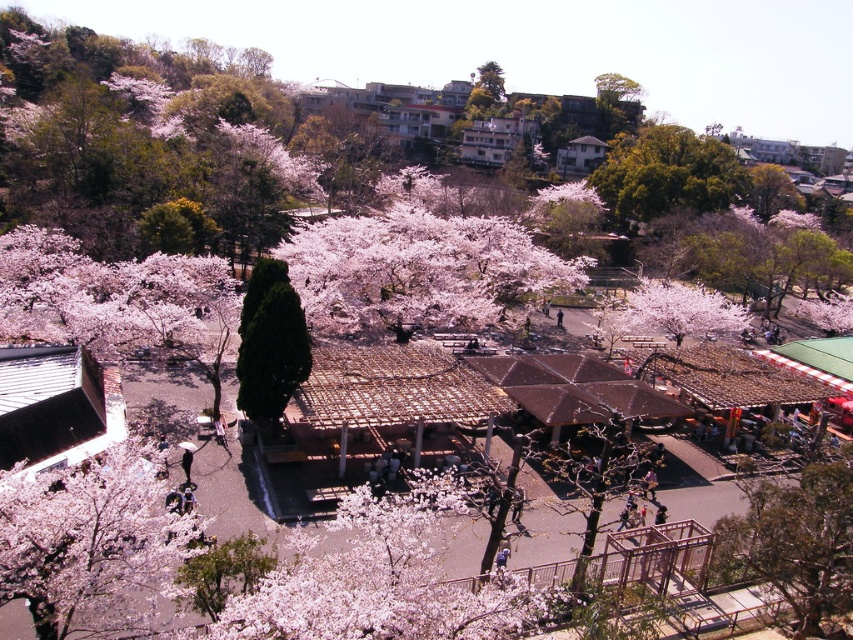
Who is shorter, pink matte flower at center or green textured tree at lower right?

With less height is green textured tree at lower right.

Measure the distance from pink matte flower at center to green textured tree at lower right.

pink matte flower at center is 43.36 meters away from green textured tree at lower right.

Between point (67, 298) and point (776, 486), which one is positioned in front?

Point (776, 486)

Find the location of `pink matte flower at center`. pink matte flower at center is located at coordinates (111, 298).

Which is more to the right, fluffy pink blossoms at lower left or green textured tree at lower right?

From the viewer's perspective, green textured tree at lower right appears more on the right side.

Is fluffy pink blossoms at lower left further to the viewer compared to green textured tree at lower right?

No.

Find the location of a particular element. Image resolution: width=853 pixels, height=640 pixels. fluffy pink blossoms at lower left is located at coordinates (91, 545).

Between green leafy tree at upper center and dark green textured tree at center, which one is positioned higher?

Positioned higher is green leafy tree at upper center.

Measure the distance between point (x=706, y=163) and camera.

A distance of 472.39 feet exists between point (x=706, y=163) and camera.

Is point (608, 172) positioned after point (270, 417)?

Yes, point (608, 172) is farther from viewer.

Identify the location of green leafy tree at upper center. (666, 173).